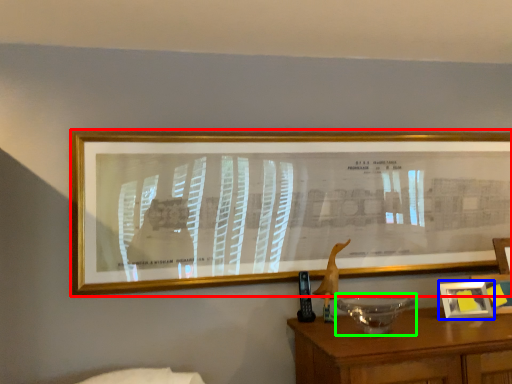
Question: Based on their relative distances, which object is nearer to picture frame (highlighted by a red box)? Choose from picture frame (highlighted by a blue box) and glass bowl (highlighted by a green box).

Choices:
 (A) picture frame
 (B) glass bowl

Answer: (B)